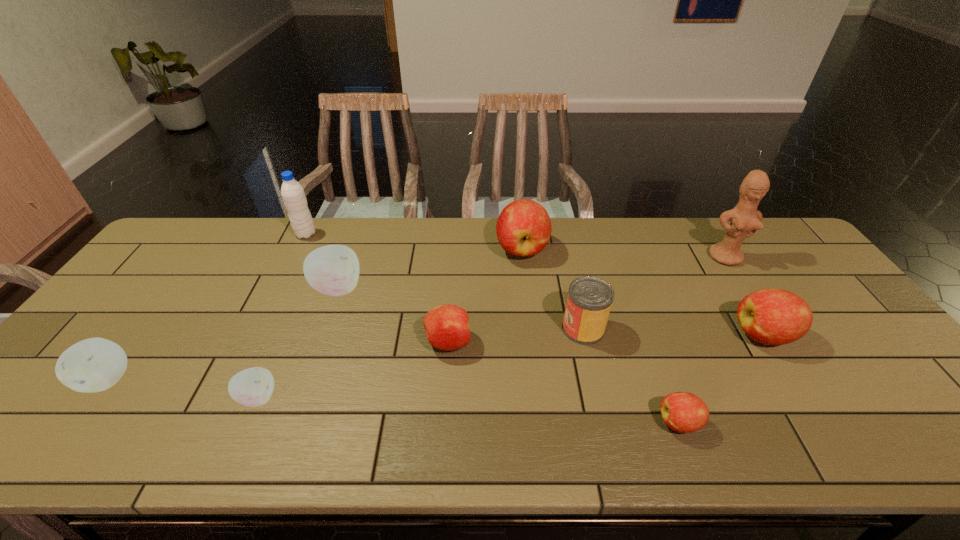
Select which red apple appears as the fourth closest to the sixth nearest apple. Please provide its 2D coordinates. Your answer should be formatted as a tuple, i.e. [(x, y)], where the tuple contains the x and y coordinates of a point satisfying the conditions above.

[(770, 316)]

Locate which red apple ranks fourth in proximity to the tallest object. Please provide its 2D coordinates. Your answer should be formatted as a tuple, i.e. [(x, y)], where the tuple contains the x and y coordinates of a point satisfying the conditions above.

[(447, 327)]

Select which white apple is the closest to the tallest object. Please provide its 2D coordinates. Your answer should be formatted as a tuple, i.e. [(x, y)], where the tuple contains the x and y coordinates of a point satisfying the conditions above.

[(333, 270)]

Choose which white apple is the nearest neighbor to the second farthest apple. Please provide its 2D coordinates. Your answer should be formatted as a tuple, i.e. [(x, y)], where the tuple contains the x and y coordinates of a point satisfying the conditions above.

[(252, 387)]